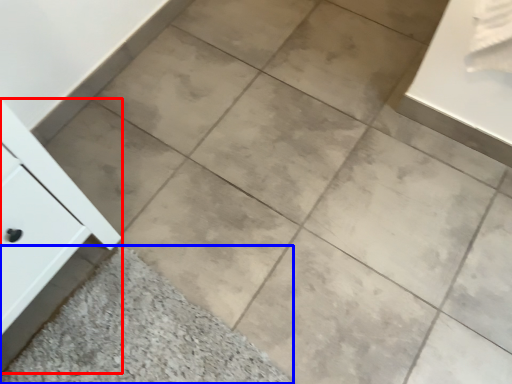
Question: Which object appears farthest to the camera in this image, cabinetry (highlighted by a red box) or ceramic tile (highlighted by a blue box)?

Choices:
 (A) cabinetry
 (B) ceramic tile

Answer: (B)